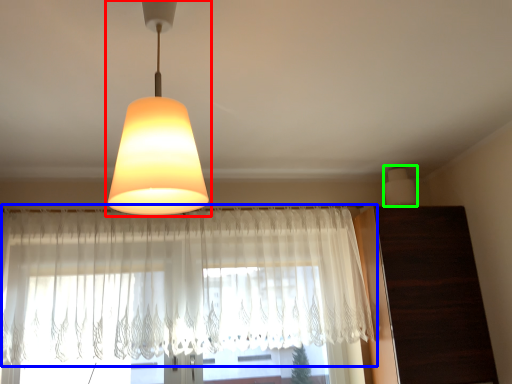
Question: Which is nearer to the lamp (highlighted by a red box)? curtain (highlighted by a blue box) or lamp (highlighted by a green box).

Choices:
 (A) curtain
 (B) lamp

Answer: (A)